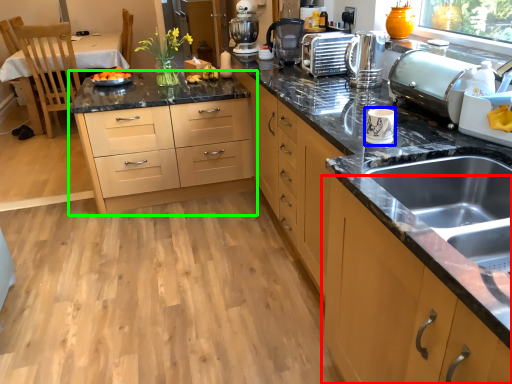
Question: Which is nearer to the cabinetry (highlighted by a red box)? appliance (highlighted by a blue box) or chest of drawers (highlighted by a green box).

Choices:
 (A) appliance
 (B) chest of drawers

Answer: (A)